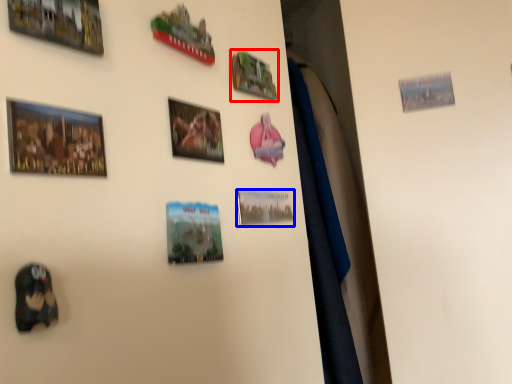
Question: Which point is further to the camera, picture frame (highlighted by a red box) or picture frame (highlighted by a blue box)?

Choices:
 (A) picture frame
 (B) picture frame

Answer: (A)